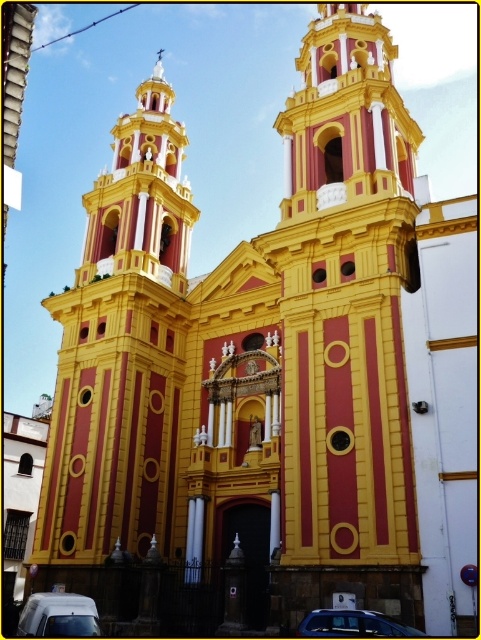
Question: Among these points, which one is nearest to the camera?

Choices:
 (A) (363, 621)
 (B) (61, 632)

Answer: (A)

Question: In this image, where is white matte van at lower left located relative to metallic blue car at lower center?

Choices:
 (A) left
 (B) right

Answer: (A)

Question: Does white matte van at lower left have a smaller size compared to metallic blue car at lower center?

Choices:
 (A) no
 (B) yes

Answer: (A)

Question: Which point is closer to the camera?

Choices:
 (A) (42, 634)
 (B) (376, 612)

Answer: (A)

Question: Does white matte van at lower left appear over metallic blue car at lower center?

Choices:
 (A) yes
 (B) no

Answer: (B)